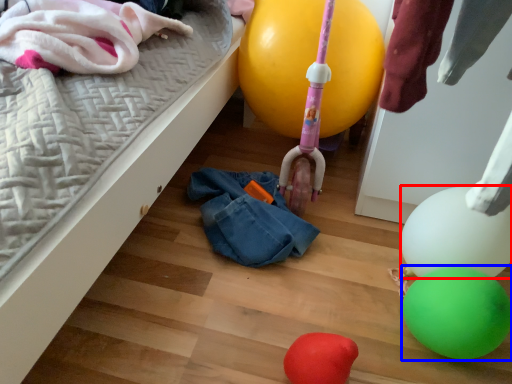
Question: Which point is further to the camera, balloon (highlighted by a red box) or balloon (highlighted by a blue box)?

Choices:
 (A) balloon
 (B) balloon

Answer: (A)